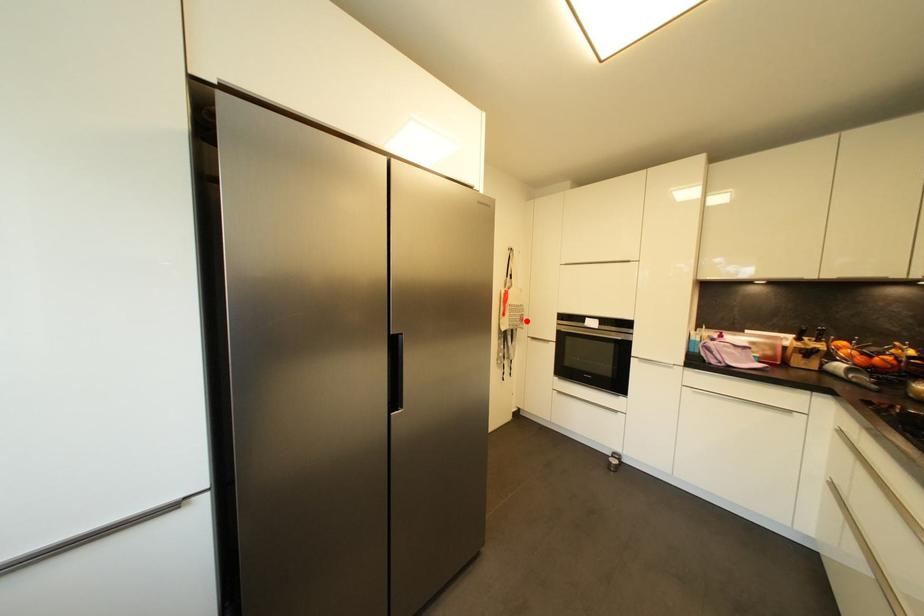
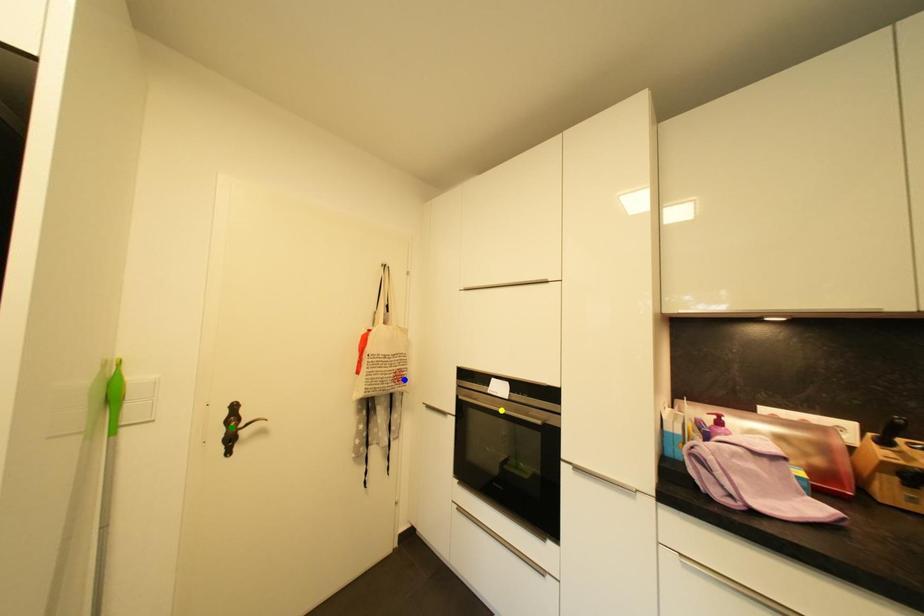
Question: I am providing you with two images of the same scene from different viewpoints. A red point is marked on the first image. You are given multiple points on the second image. Which point in image 2 represents the same 3d spot as the red point in image 1?

Choices:
 (A) blue point
 (B) green point
 (C) yellow point

Answer: (A)